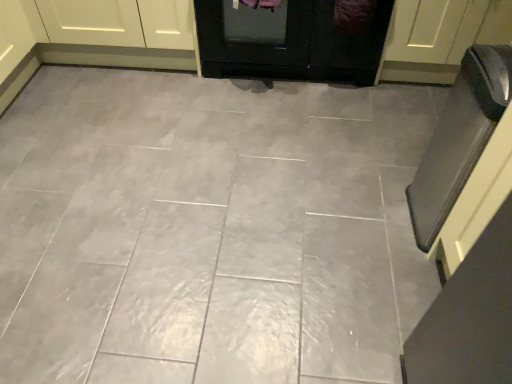
Question: Considering the positions of matte white cabinet at upper left and white glossy door at upper right, the second door when ordered from left to right, in the image, is matte white cabinet at upper left taller or shorter than white glossy door at upper right, the second door when ordered from left to right,?

Choices:
 (A) tall
 (B) short

Answer: (B)

Question: Is matte white cabinet at upper left in front of or behind white glossy door at upper right, which appears as the first door when viewed from the right, in the image?

Choices:
 (A) behind
 (B) front

Answer: (A)

Question: Which of these objects is positioned closest to the gray glossy tile at center?

Choices:
 (A) black glass oven at right
 (B) white glossy door at upper right, the second door when ordered from left to right
 (C) black glossy door at center, the second door in the right-to-left sequence
 (D) matte white cabinet at upper left

Answer: (A)

Question: Estimate the real-world distances between objects in this image. Which object is farther from the gray glossy tile at center?

Choices:
 (A) matte white cabinet at upper left
 (B) white glossy door at upper right, which appears as the first door when viewed from the right
 (C) black glass oven at right
 (D) black glossy door at center, the second door in the right-to-left sequence

Answer: (B)